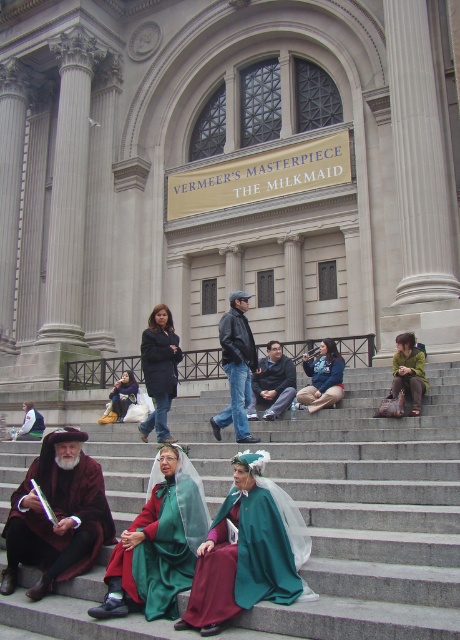
Does smooth stone stairs at center have a larger size compared to leather jacket at center?

Indeed, smooth stone stairs at center has a larger size compared to leather jacket at center.

Is smooth stone stairs at center further to camera compared to leather jacket at center?

No.

You are a GUI agent. You are given a task and a screenshot of the screen. Output one action in this format:
    pyautogui.click(x=<x>, y=<y>)
    Task: Click on the smooth stone stairs at center
    This screenshot has height=640, width=460.
    Given the screenshot: What is the action you would take?
    pyautogui.click(x=369, y=515)

Does green velvet cape at lower center come in front of leather jacket at center?

Yes.

Who is more distant from viewer, (157, 476) or (241, 292)?

Positioned behind is point (241, 292).

Find the location of a particular element. Image resolution: width=460 pixels, height=640 pixels. green velvet cape at lower center is located at coordinates (159, 541).

Identify the location of green velvet cape at lower center. Image resolution: width=460 pixels, height=640 pixels. (159, 541).

Is smooth stone stairs at center wider than green velvet cape at center?

Correct, the width of smooth stone stairs at center exceeds that of green velvet cape at center.

Is smooth stone stairs at center positioned in front of green velvet cape at center?

Yes, smooth stone stairs at center is closer to the viewer.

Does point (400, 419) lie in front of point (253, 515)?

No, it is behind (253, 515).

Image resolution: width=460 pixels, height=640 pixels. I want to click on smooth stone stairs at center, so click(369, 515).